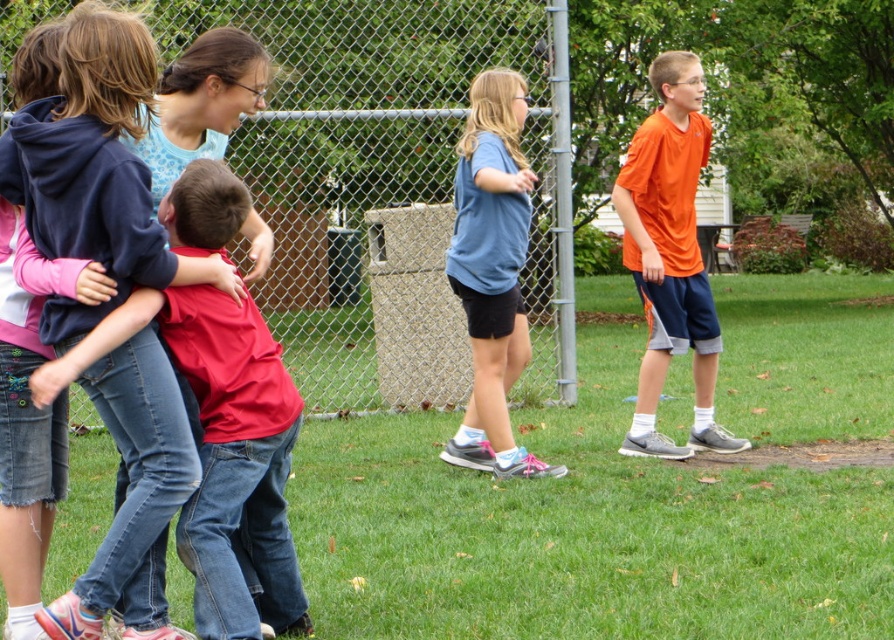
You are standing at the origin point of the image. Which of the two points, point (133, 564) or point (285, 378), is closer to you?

Point (133, 564) is closer to you because it is in front of point (285, 378).

You are a photographer trying to capture a group photo of the orange matte shirt at right and the blue cotton shirt at center. Which child should you position closer to the camera to ensure both appear the same size in the photo?

To make both the orange matte shirt at right and the blue cotton shirt at center appear the same size in the photo, position the blue cotton shirt at center closer to the camera since the orange matte shirt at right is wider. A wider object appears larger when farther away, so moving the narrower blue cotton shirt at center forward will balance their apparent sizes.